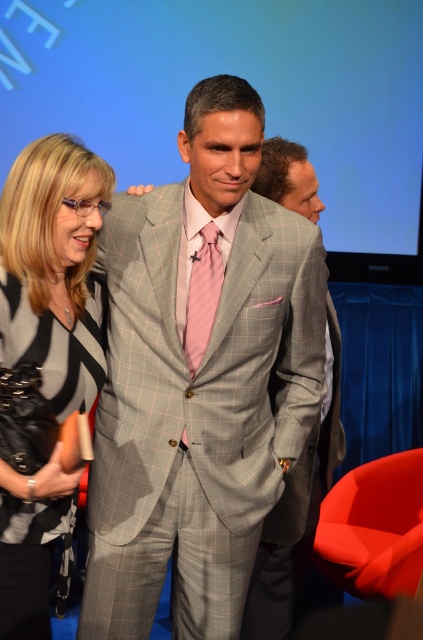
You are a photographer at a formal event. You need to capture a photo of the light gray checkered suit at center and the pink satin tie at center. Which one is lower in the frame?

The light gray checkered suit at center is positioned under the pink satin tie at center, so the light gray checkered suit at center is lower in the frame.

You are a photographer at the event and need to place a small prop at the exact coordinates provided. The prop is 0.05 units in diameter. Will placing it at point (54, 268) interfere with the black textured blazer at left?

The black textured blazer at left is located exactly at point (54, 268), so placing the prop there would directly interfere with it.